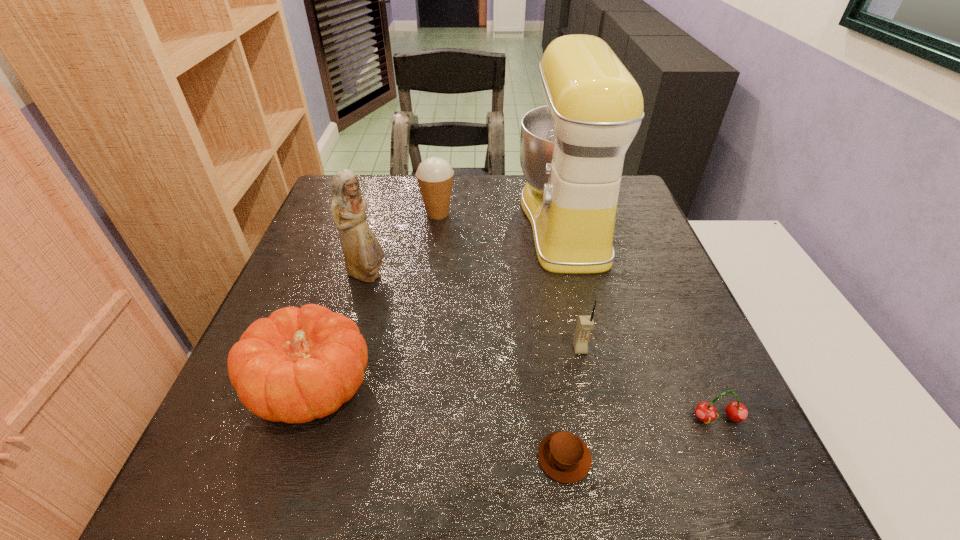
Identify the location of free point that satisfies the following two spatial constraints: 1. on the side of the tallest object with the control knob; 2. on the front side of the pumpkin. This screenshot has height=540, width=960. (606, 387).

Find the location of a particular element. This screenshot has height=540, width=960. vacant region that satisfies the following two spatial constraints: 1. on the side of the tallest object with the control knob; 2. on the front side of the pumpkin is located at coordinates (606, 387).

Find the location of a particular element. The image size is (960, 540). free spot that satisfies the following two spatial constraints: 1. on the front side of the pumpkin; 2. on the left side of the shortest object is located at coordinates [289, 458].